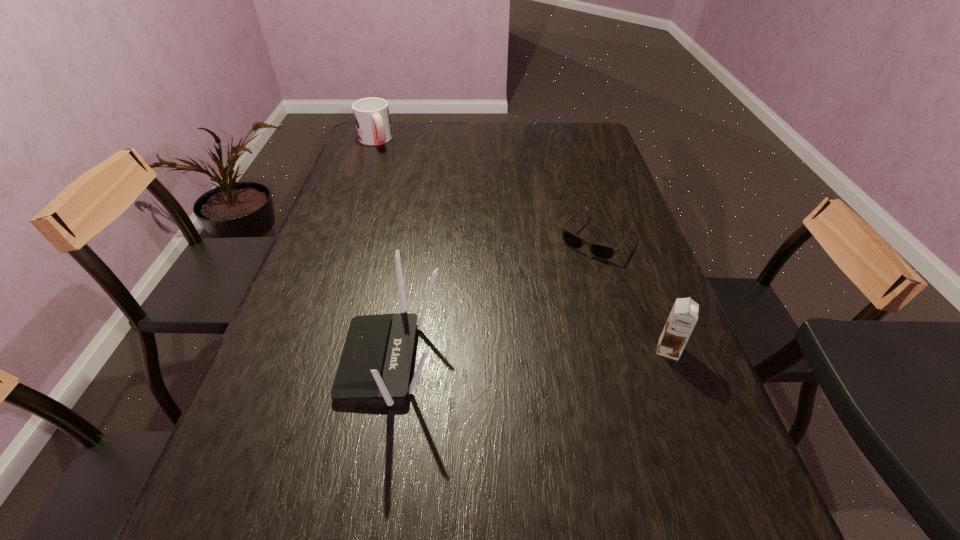
This screenshot has width=960, height=540. I want to click on sunglasses present at the right edge, so click(600, 251).

In order to click on object that is at the far left corner in this screenshot , I will do `click(372, 118)`.

The image size is (960, 540). In order to click on vacant space at the far edge of the desktop in this screenshot , I will do `click(494, 146)`.

The width and height of the screenshot is (960, 540). In the image, there is a desktop. Find the location of `free space at the near edge`. free space at the near edge is located at coordinates (406, 453).

At what (x,y) coordinates should I click in order to perform the action: click on vacant space at the left edge. Please return your answer as a coordinate pair (x, y). This screenshot has width=960, height=540. Looking at the image, I should click on (364, 169).

In the image, there is a desktop. Find the location of `free space at the right edge`. free space at the right edge is located at coordinates (669, 309).

Locate an element on the screen. Image resolution: width=960 pixels, height=540 pixels. free point at the far right corner is located at coordinates (584, 152).

Identify the location of empty space between the shortest object and the leftmost object. This screenshot has height=540, width=960. (485, 189).

Where is `blank region between the sunglasses and the chocolate milk`? This screenshot has height=540, width=960. blank region between the sunglasses and the chocolate milk is located at coordinates (633, 293).

Locate an element on the screen. vacant point located between the router and the mug is located at coordinates (383, 250).